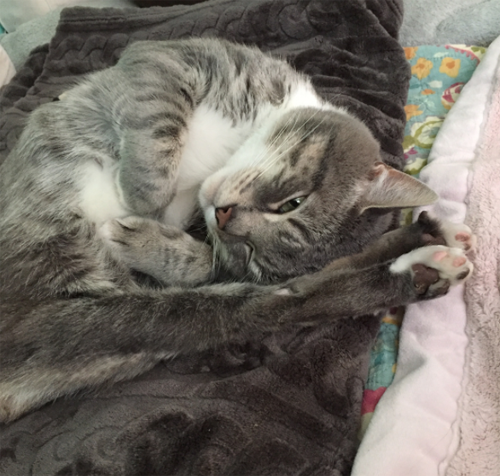
The height and width of the screenshot is (476, 500). I want to click on grey blanket, so click(x=451, y=17).